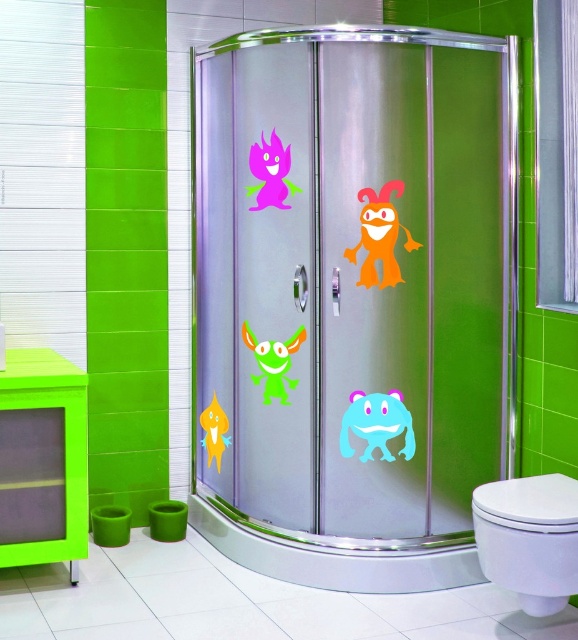
Does white glossy toilet bowl at lower right appear over green glossy alien at center?

No.

Who is positioned more to the right, white glossy toilet bowl at lower right or green glossy alien at center?

From the viewer's perspective, white glossy toilet bowl at lower right appears more on the right side.

Is point (544, 477) in front of point (279, 396)?

Yes.

The image size is (578, 640). I want to click on white glossy toilet bowl at lower right, so click(529, 538).

Based on the photo, does transparent glass shower door at center appear on the right side of pink glossy monster at upper center?

Yes, transparent glass shower door at center is to the right of pink glossy monster at upper center.

Who is positioned more to the left, transparent glass shower door at center or pink glossy monster at upper center?

pink glossy monster at upper center is more to the left.

What do you see at coordinates (353, 300) in the screenshot?
I see `transparent glass shower door at center` at bounding box center [353, 300].

I want to click on transparent glass shower door at center, so [353, 300].

Between point (272, 177) and point (264, 349), which one is positioned behind?

Positioned behind is point (264, 349).

Which is more to the left, pink glossy monster at upper center or green glossy alien at center?

pink glossy monster at upper center is more to the left.

Who is more forward, (275, 192) or (294, 339)?

Point (275, 192) is more forward.

Identify the location of pink glossy monster at upper center. (271, 173).